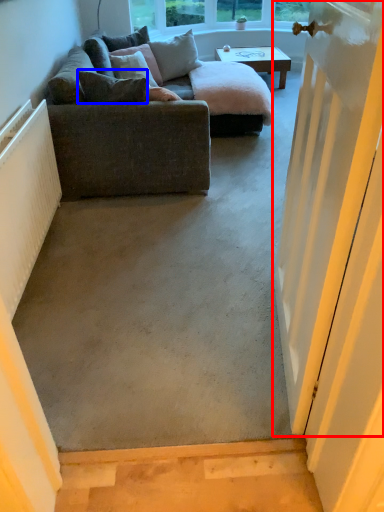
Question: Which object is further to the camera taking this photo, door (highlighted by a red box) or pillow (highlighted by a blue box)?

Choices:
 (A) door
 (B) pillow

Answer: (B)